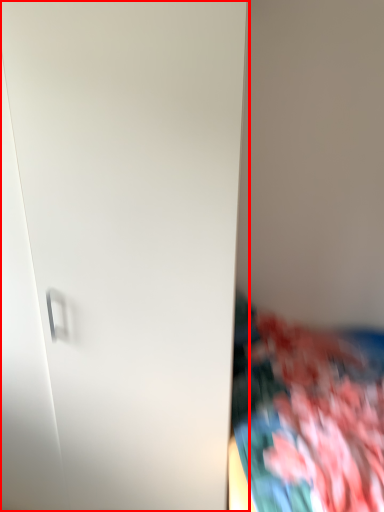
Question: From the image's perspective, what is the correct spatial relationship of door (annotated by the red box) in relation to textile?

Choices:
 (A) above
 (B) below

Answer: (A)